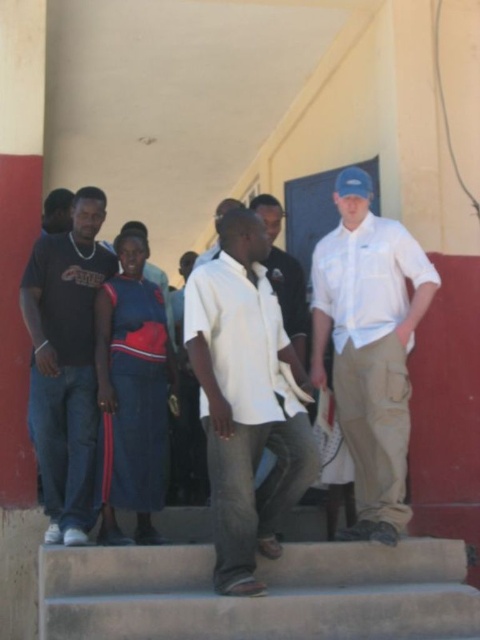
Does point (252, 275) lie in front of point (346, 196)?

Yes, point (252, 275) is in front of point (346, 196).

Is white cotton shirt at center to the right of matte khaki pants at right from the viewer's perspective?

No, white cotton shirt at center is not to the right of matte khaki pants at right.

Between point (220, 284) and point (367, 352), which one is positioned in front?

Point (220, 284) is more forward.

You are a GUI agent. You are given a task and a screenshot of the screen. Output one action in this format:
    pyautogui.click(x=<x>, y=<y>)
    Task: Click on the white cotton shirt at center
    This screenshot has height=640, width=480.
    Given the screenshot: What is the action you would take?
    pyautogui.click(x=245, y=401)

Is concrete stairs at center behind white cotton shirt at center?

No, concrete stairs at center is closer to the viewer.

What do you see at coordinates (260, 596) in the screenshot?
I see `concrete stairs at center` at bounding box center [260, 596].

Who is more forward, (156, 588) or (238, 332)?

Point (156, 588) is more forward.

What are the coordinates of `concrete stairs at center` in the screenshot? It's located at (260, 596).

Does point (313, 464) lie behind point (82, 326)?

No, (313, 464) is in front of (82, 326).

Image resolution: width=480 pixels, height=640 pixels. What do you see at coordinates (245, 401) in the screenshot?
I see `white cotton shirt at center` at bounding box center [245, 401].

Locate an element on the screen. white cotton shirt at center is located at coordinates (245, 401).